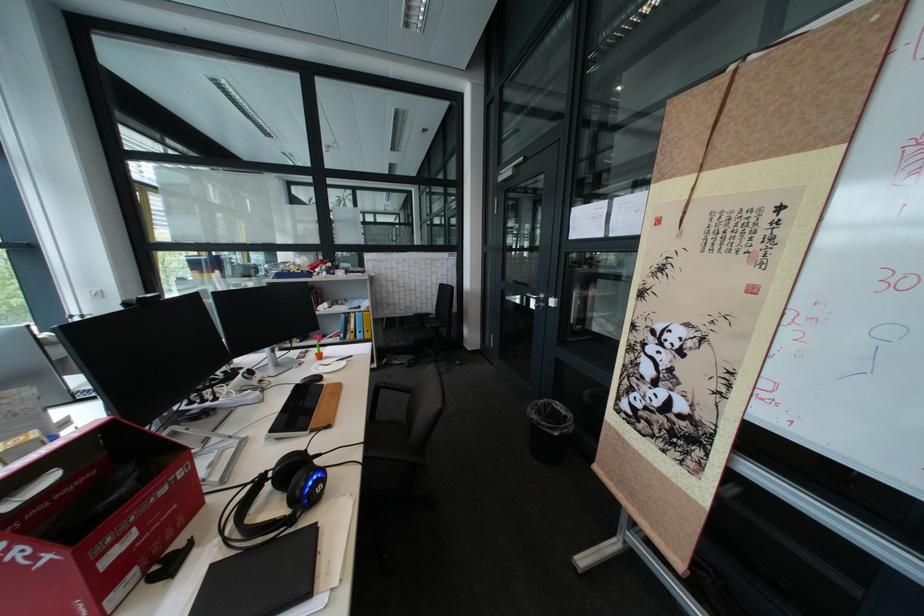
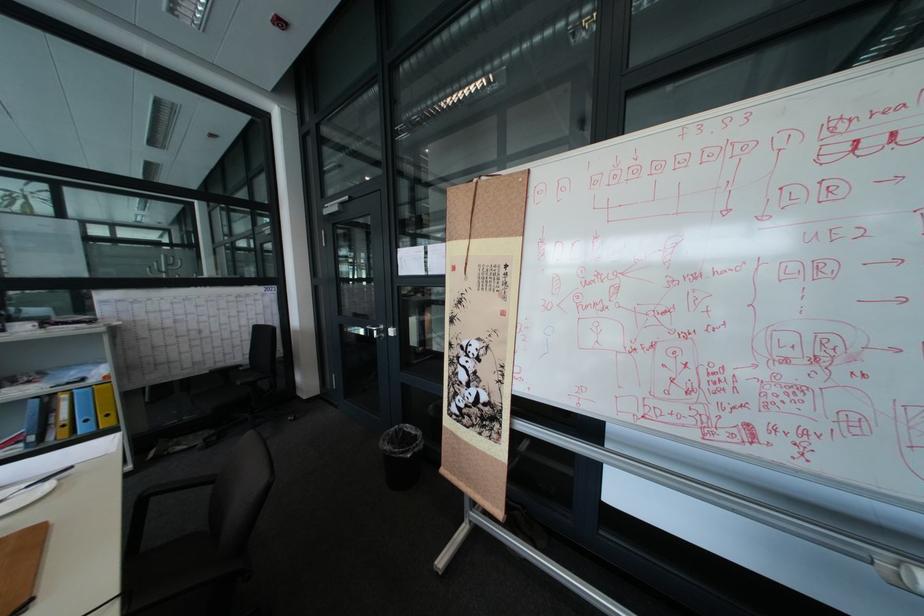
Question: How did the camera likely rotate?

Choices:
 (A) Left
 (B) Right
 (C) Up
 (D) Down

Answer: (B)